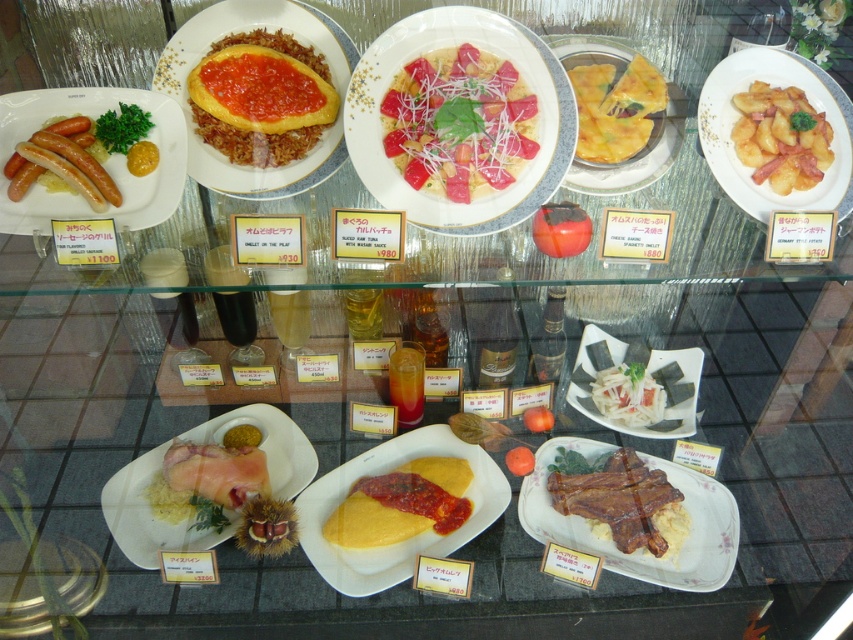
Between shiny red tomato at center and yellow matte polenta at center, which one appears on the right side from the viewer's perspective?

yellow matte polenta at center is more to the right.

Which is behind, point (453, 80) or point (515, 448)?

Positioned behind is point (515, 448).

Locate an element on the screen. This screenshot has width=853, height=640. shiny red tomato at center is located at coordinates (459, 122).

Can you confirm if matte yellow omelette at center is thinner than white matte seaweed salad at center?

Indeed, matte yellow omelette at center has a lesser width compared to white matte seaweed salad at center.

Can you confirm if matte yellow omelette at center is taller than white matte seaweed salad at center?

Correct, matte yellow omelette at center is much taller as white matte seaweed salad at center.

Who is more forward, (250, 68) or (688, 349)?

Point (250, 68) is in front.

Find the location of a particular element. matte yellow omelette at center is located at coordinates (260, 97).

Can you confirm if white matte seaweed salad at center is bigger than yellow crispy pastry at center?

No.

Can you confirm if white matte seaweed salad at center is wider than yellow crispy pastry at center?

Correct, the width of white matte seaweed salad at center exceeds that of yellow crispy pastry at center.

Is point (688, 419) farther from camera compared to point (601, 179)?

That is True.

Image resolution: width=853 pixels, height=640 pixels. What are the coordinates of `white matte seaweed salad at center` in the screenshot? It's located at (635, 387).